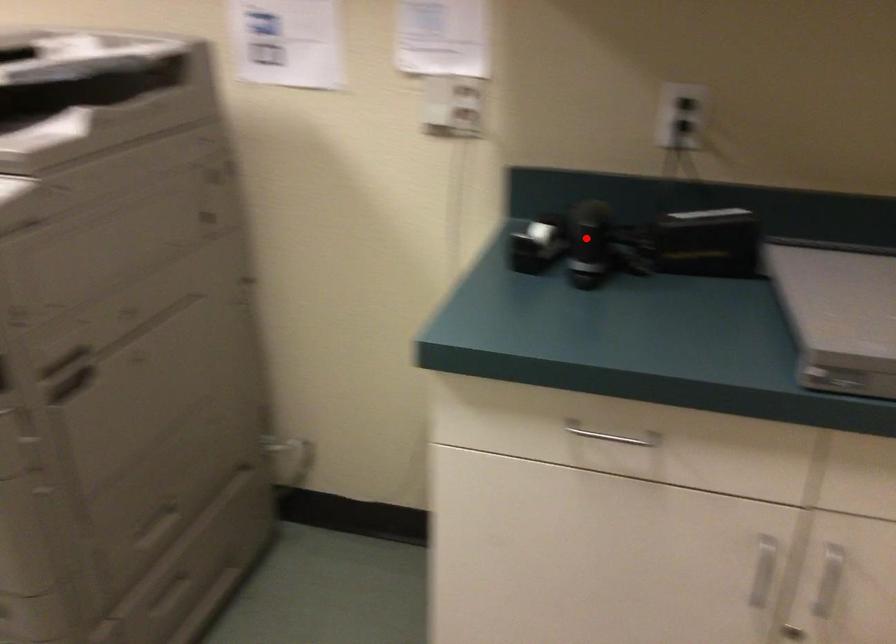
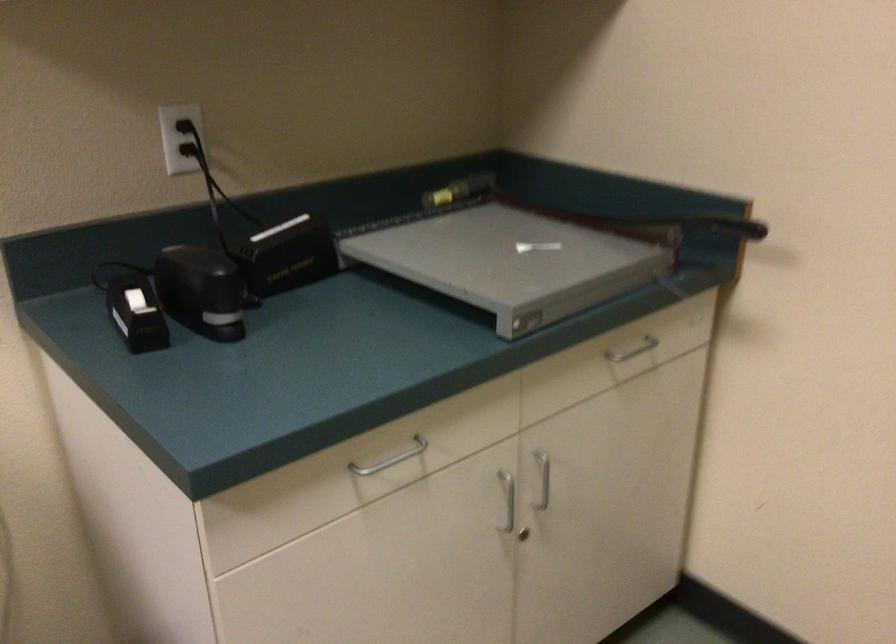
In the second image, find the point that corresponds to the highlighted location in the first image.

(202, 290)